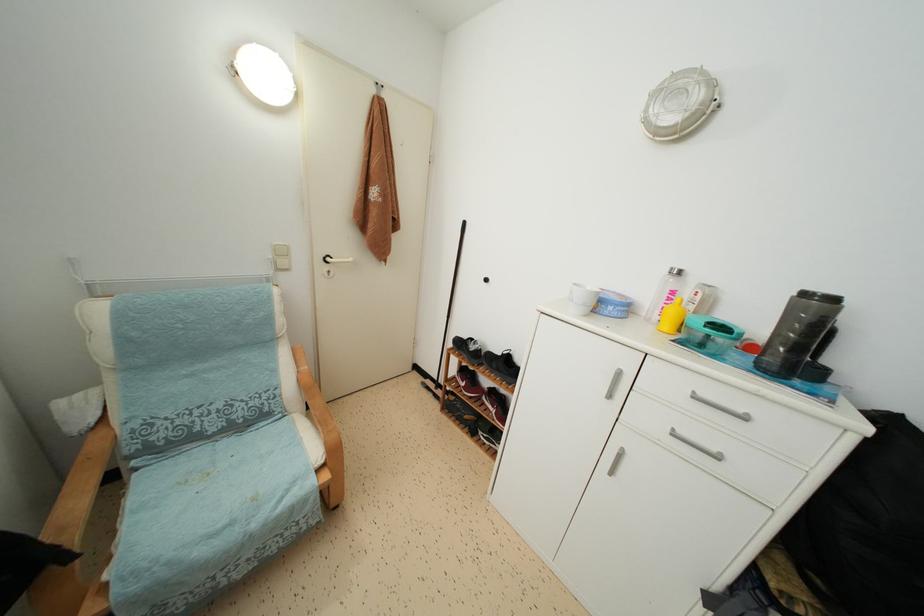
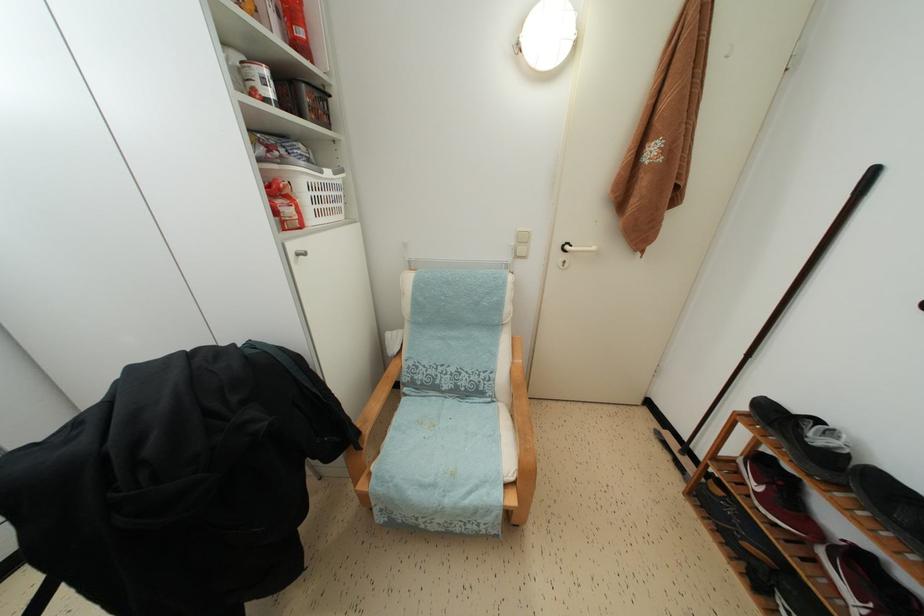
Where in the second image is the point corresponding to (435,391) from the first image?

(678, 450)